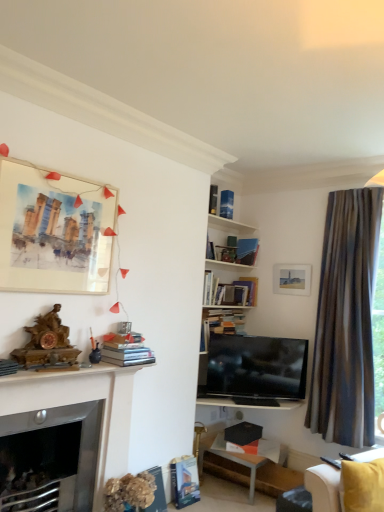
This screenshot has height=512, width=384. I want to click on free point above watercolor paper painting at upper left, marked as the 1th picture frame in a left-to-right arrangement (from a real-world perspective), so click(x=67, y=174).